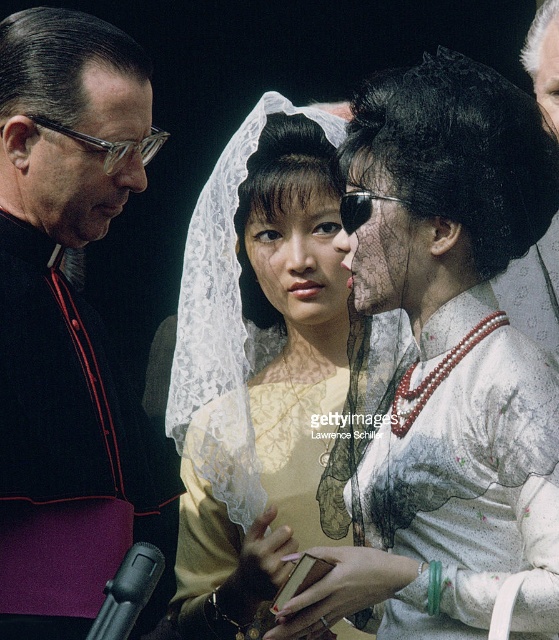
Does pearl necklace at center come behind matte yellow lace veil at center?

No, pearl necklace at center is closer to the viewer.

This screenshot has width=559, height=640. What do you see at coordinates (438, 355) in the screenshot? I see `pearl necklace at center` at bounding box center [438, 355].

Locate an element on the screen. The height and width of the screenshot is (640, 559). pearl necklace at center is located at coordinates pyautogui.click(x=438, y=355).

Between white sheer fabric robe at center and black velvet robe at left, which one appears on the right side from the viewer's perspective?

From the viewer's perspective, white sheer fabric robe at center appears more on the right side.

Between point (511, 426) and point (92, 218), which one is positioned in front?

Point (511, 426) is more forward.

Image resolution: width=559 pixels, height=640 pixels. Identify the location of white sheer fabric robe at center. (453, 467).

Who is shorter, matte yellow lace veil at center or gray velvet hat at upper right?

gray velvet hat at upper right is shorter.

Who is lower down, matte yellow lace veil at center or gray velvet hat at upper right?

matte yellow lace veil at center is lower down.

Does point (338, 369) come behind point (551, 288)?

Yes, point (338, 369) is farther from viewer.

What are the coordinates of `matte yellow lace veil at center` in the screenshot? It's located at (258, 348).